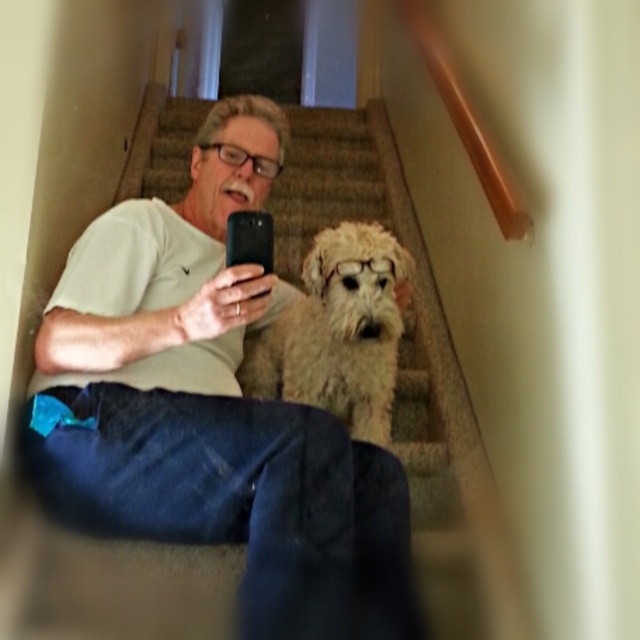
You are standing at the bottom of the staircase and want to take a photo of the man and the dog. The man is at point (337, 627) and the dog is at point (324, 392). Since you want both subjects in the frame, which point should you aim your camera towards first?

You should aim your camera towards point (337, 627) first because it is in front of point (324, 392), ensuring both subjects are in the frame.

You are standing at the bottom of the staircase in the image. You want to place a small gift box on the white cotton shirt at center located at point (x=211, y=410). Is this location safe to place the box without disturbing the man or the dog?

The white cotton shirt at center is located at point (x=211, y=410), so placing the gift box there would likely disturb the man or the dog since the shirt is in their immediate vicinity.

You are standing at the bottom of the staircase and want to place a small object on the white cotton shirt at center. Can you determine the direction you should move towards to reach the shirt?

The white cotton shirt at center is located at point (211, 410), so you should move towards the upper right direction from your current position at the bottom of the staircase to reach the shirt.